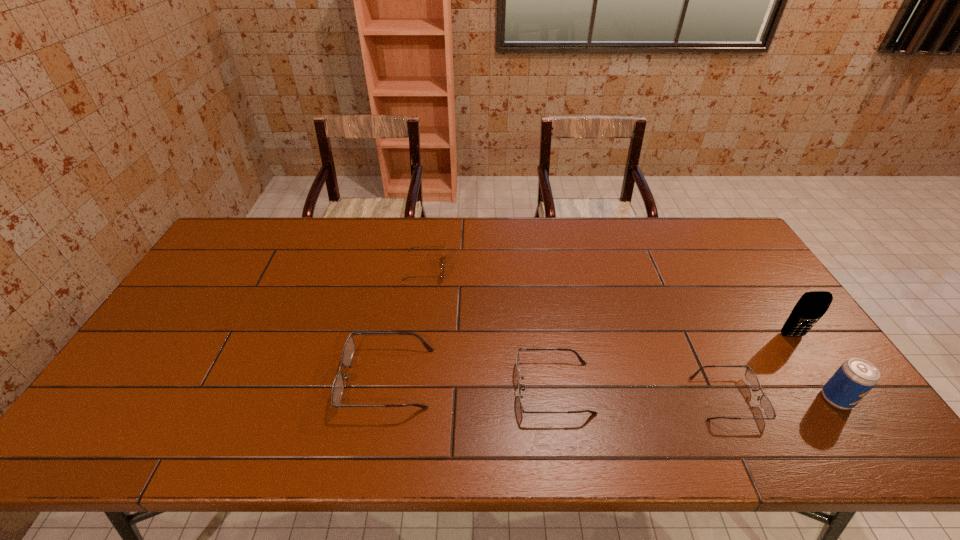
In the image, there is a desktop. Where is `free space at the near left corner`? free space at the near left corner is located at coordinates (136, 409).

The width and height of the screenshot is (960, 540). I want to click on free region at the far right corner, so click(726, 238).

Image resolution: width=960 pixels, height=540 pixels. What are the coordinates of `vacant space at the near right corner of the desktop` in the screenshot? It's located at (822, 390).

Locate an element on the screen. This screenshot has height=540, width=960. free space between the fifth shortest object and the fourth object from left to right is located at coordinates pyautogui.click(x=782, y=399).

Where is `empty space between the third object from right to left and the third object from left to right`? The width and height of the screenshot is (960, 540). empty space between the third object from right to left and the third object from left to right is located at coordinates (641, 393).

Where is `free space between the tallest object and the third object from right to left`? free space between the tallest object and the third object from right to left is located at coordinates (760, 367).

This screenshot has width=960, height=540. Identify the location of free spot between the tallest object and the tallest spectacles. (589, 357).

Identify the location of empty space that is in between the sunglasses and the tallest object. (609, 302).

This screenshot has height=540, width=960. In order to click on vacant area that lies between the third object from left to right and the shortest object in this screenshot , I will do `click(641, 393)`.

Locate an element on the screen. The width and height of the screenshot is (960, 540). free space between the second farthest object and the farthest object is located at coordinates (609, 302).